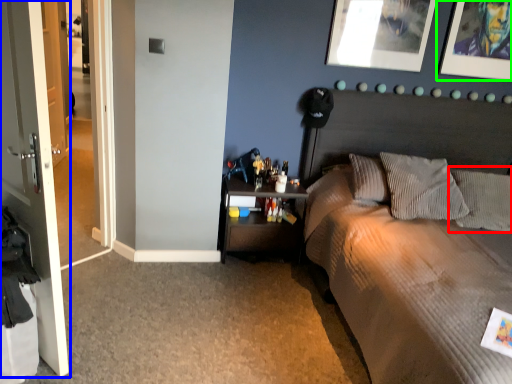
Question: Based on their relative distances, which object is nearer to pillow (highlighted by a red box)? Choose from door (highlighted by a blue box) and picture frame (highlighted by a green box).

Choices:
 (A) door
 (B) picture frame

Answer: (B)